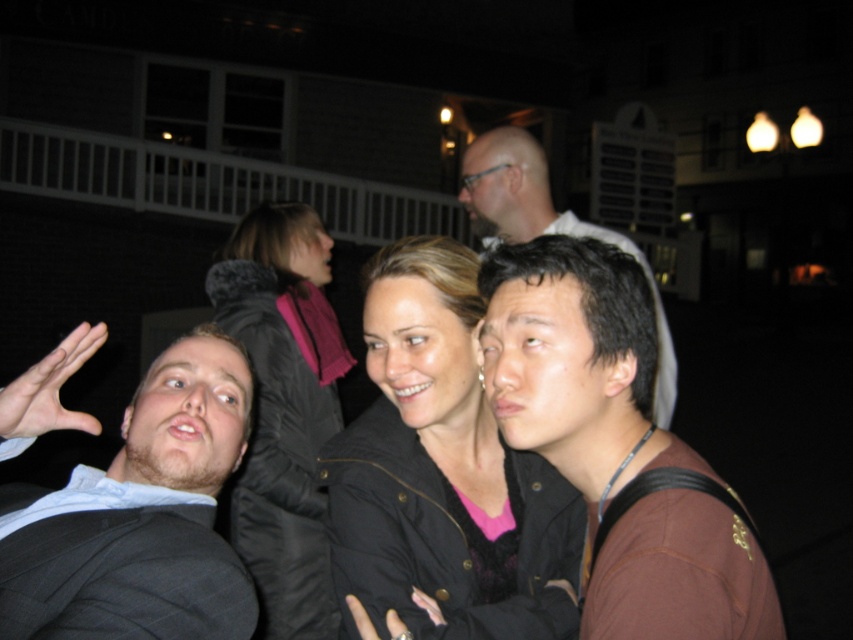
Is the position of brown matte jacket at center less distant than that of smooth brown hair at center?

Yes, brown matte jacket at center is closer to the viewer.

Who is higher up, brown matte jacket at center or smooth brown hair at center?

smooth brown hair at center is above.

Does point (618, 392) come behind point (596, 236)?

No, it is not.

At what (x,y) coordinates should I click in order to perform the action: click on brown matte jacket at center. Please return your answer as a coordinate pair (x, y). This screenshot has width=853, height=640. Looking at the image, I should click on (575, 364).

Between gray suit at left and black puffy jacket at upper center, which one is positioned lower?

black puffy jacket at upper center

The height and width of the screenshot is (640, 853). What do you see at coordinates (138, 516) in the screenshot?
I see `gray suit at left` at bounding box center [138, 516].

Where is `gray suit at left`? gray suit at left is located at coordinates (138, 516).

How much distance is there between black leather jacket at center and gray suit at left?

black leather jacket at center is 15.97 inches from gray suit at left.

Measure the distance between black leather jacket at center and camera.

The distance of black leather jacket at center from camera is 5.05 feet.

Identify the location of black leather jacket at center. The image size is (853, 640). (444, 472).